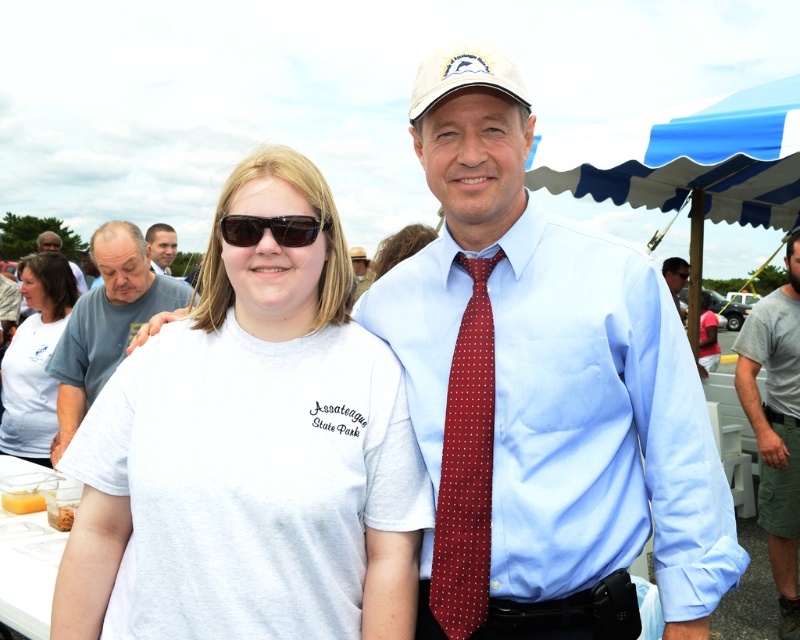
Question: Does light blue cotton shirt at center come behind matte white hat at upper center?

Choices:
 (A) yes
 (B) no

Answer: (B)

Question: Among these points, which one is nearest to the camera?

Choices:
 (A) (648, 372)
 (B) (672, 273)
 (C) (34, 282)

Answer: (A)

Question: Does white cotton t-shirt at center appear on the left side of black plastic goggles at center?

Choices:
 (A) no
 (B) yes

Answer: (B)

Question: Among these points, which one is nearest to the camera?

Choices:
 (A) (794, 269)
 (B) (670, 262)

Answer: (A)

Question: Is white matte baseball cap at upper center bigger than light blue shirt at center?

Choices:
 (A) yes
 (B) no

Answer: (B)

Question: Which object appears farthest from the camera in this image?

Choices:
 (A) white cotton t-shirt at left
 (B) gray cotton t-shirt at lower right
 (C) blue striped canopy at upper right

Answer: (C)